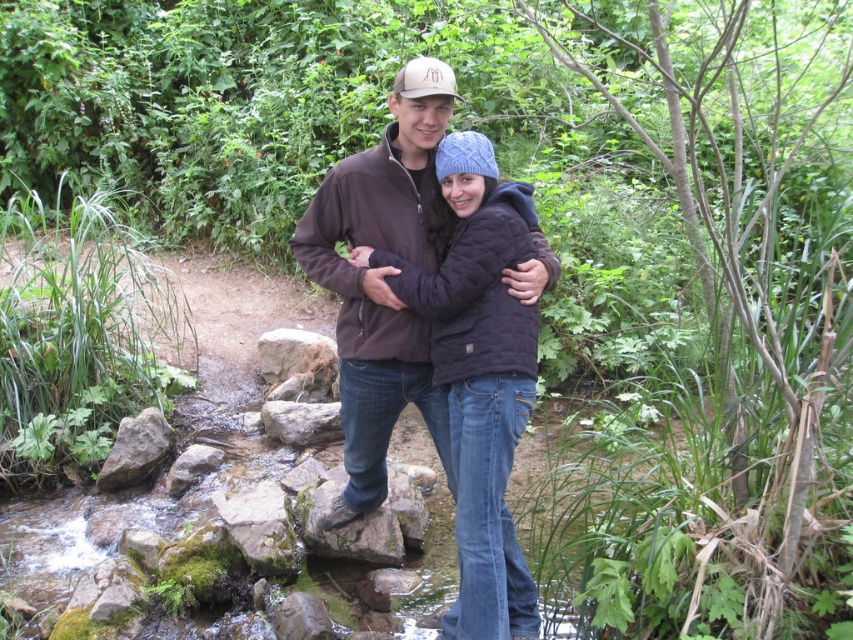
What do you see at coordinates (300, 420) in the screenshot? The height and width of the screenshot is (640, 853). I see `gray rough rock at center` at bounding box center [300, 420].

Who is positioned more to the right, gray rough rock at center or matte brown baseball cap at upper center?

matte brown baseball cap at upper center

Describe the element at coordinates (300, 420) in the screenshot. I see `gray rough rock at center` at that location.

Where is `gray rough rock at center`? gray rough rock at center is located at coordinates (300, 420).

Between gray rough rock at center and mossy rock at center, which one is positioned higher?

Positioned higher is gray rough rock at center.

Does point (289, 422) come in front of point (184, 477)?

No.

Which is behind, point (271, 406) or point (202, 461)?

Positioned behind is point (271, 406).

In order to click on gray rough rock at center in this screenshot , I will do click(300, 420).

Where is `gray rough rock at lower left`? This screenshot has width=853, height=640. gray rough rock at lower left is located at coordinates [x=135, y=449].

Is point (120, 452) more distant than point (318, 436)?

No, (120, 452) is in front of (318, 436).

The image size is (853, 640). In order to click on gray rough rock at lower left in this screenshot , I will do `click(135, 449)`.